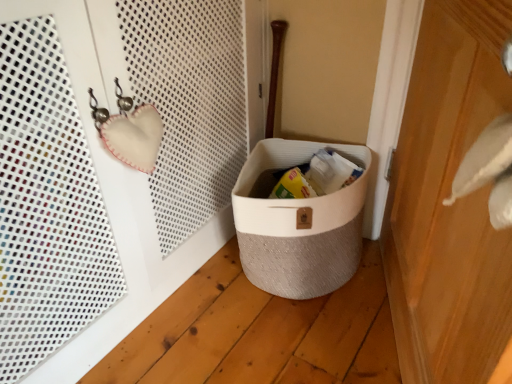
What is the approximate width of wooden door at right?

The width of wooden door at right is 23.97 centimeters.

Where is `wooden door at right`? wooden door at right is located at coordinates click(x=448, y=207).

Describe the element at coordinates (448, 207) in the screenshot. I see `wooden door at right` at that location.

Find the location of a particular element. Image resolution: width=512 pixels, height=384 pixels. beige textured basket at lower center is located at coordinates (298, 223).

What is the approximate height of beige textured basket at lower center?

The height of beige textured basket at lower center is 14.53 inches.

Image resolution: width=512 pixels, height=384 pixels. What do you see at coordinates (298, 223) in the screenshot? I see `beige textured basket at lower center` at bounding box center [298, 223].

Identify the location of wooden door at right. (448, 207).

Considering the positions of objects wooden door at right and beige textured basket at lower center in the image provided, who is more to the left, wooden door at right or beige textured basket at lower center?

Positioned to the left is beige textured basket at lower center.

Is wooden door at right positioned before beige textured basket at lower center?

Yes, wooden door at right is in front of beige textured basket at lower center.

Which is closer to the camera, (439, 167) or (302, 259)?

Point (439, 167) appears to be closer to the viewer than point (302, 259).

From the image's perspective, which is below, wooden door at right or beige textured basket at lower center?

beige textured basket at lower center, from the image's perspective.

From a real-world perspective, is wooden door at right physically below beige textured basket at lower center?

No, from a real-world perspective, wooden door at right is not below beige textured basket at lower center.

In terms of width, does wooden door at right look wider or thinner when compared to beige textured basket at lower center?

Clearly, wooden door at right has less width compared to beige textured basket at lower center.

Based on the photo, considering the sizes of objects wooden door at right and beige textured basket at lower center in the image provided, who is shorter, wooden door at right or beige textured basket at lower center?

With less height is beige textured basket at lower center.

Does wooden door at right have a larger size compared to beige textured basket at lower center?

Indeed, wooden door at right has a larger size compared to beige textured basket at lower center.

Can we say wooden door at right lies outside beige textured basket at lower center?

Yes, wooden door at right is located beyond the bounds of beige textured basket at lower center.

Is wooden door at right far away from beige textured basket at lower center?

No, wooden door at right is in close proximity to beige textured basket at lower center.

Could you tell me if wooden door at right is facing beige textured basket at lower center?

Yes, wooden door at right is aimed at beige textured basket at lower center.

Can you tell me how much wooden door at right and beige textured basket at lower center differ in facing direction?

The angular difference between wooden door at right and beige textured basket at lower center is 89.4 degrees.

Measure the distance from wooden door at right to beige textured basket at lower center.

The distance of wooden door at right from beige textured basket at lower center is 12.36 inches.

Image resolution: width=512 pixels, height=384 pixels. Identify the location of storage box on the left of wooden door at right. (298, 223).

Between beige textured basket at lower center and wooden door at right, which one appears on the left side from the viewer's perspective?

beige textured basket at lower center.

In the scene shown: In the image, is beige textured basket at lower center positioned in front of or behind wooden door at right?

beige textured basket at lower center is positioned farther from the viewer than wooden door at right.

Which is behind, point (319, 287) or point (454, 52)?

Positioned behind is point (319, 287).

From the image's perspective, is beige textured basket at lower center above or below wooden door at right?

From the image's perspective, beige textured basket at lower center appears below wooden door at right.

From a real-world perspective, which object rests below the other?

From a 3D spatial view, beige textured basket at lower center is below.

Between beige textured basket at lower center and wooden door at right, which one has smaller width?

wooden door at right.

Is beige textured basket at lower center taller or shorter than wooden door at right?

In the image, beige textured basket at lower center appears to be shorter than wooden door at right.

Considering the relative sizes of beige textured basket at lower center and wooden door at right in the image provided, is beige textured basket at lower center smaller than wooden door at right?

Correct, beige textured basket at lower center occupies less space than wooden door at right.

Would you say beige textured basket at lower center is inside or outside wooden door at right?

beige textured basket at lower center exists outside the volume of wooden door at right.

Is beige textured basket at lower center not near wooden door at right?

No, beige textured basket at lower center is in close proximity to wooden door at right.

Is beige textured basket at lower center facing towards wooden door at right?

No, beige textured basket at lower center is not turned towards wooden door at right.

How different are the orientations of beige textured basket at lower center and wooden door at right in degrees?

beige textured basket at lower center and wooden door at right are facing 89.4 degrees away from each other.

The image size is (512, 384). In order to click on door above the beige textured basket at lower center (from the image's perspective) in this screenshot , I will do `click(448, 207)`.

Where is `storage box behind the wooden door at right`? The image size is (512, 384). storage box behind the wooden door at right is located at coordinates (298, 223).

The height and width of the screenshot is (384, 512). What are the coordinates of `door on the right of the beige textured basket at lower center` in the screenshot? It's located at (448, 207).